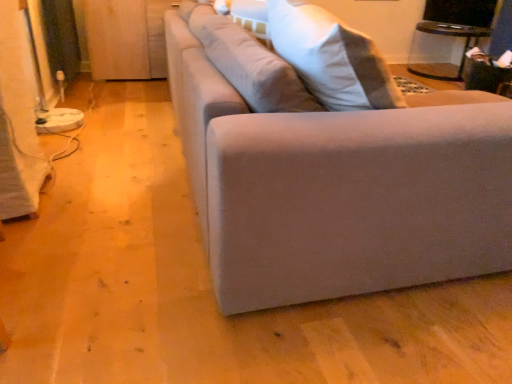
Question: Can you confirm if transparent glass table at upper right is smaller than suede-like beige couch at center?

Choices:
 (A) yes
 (B) no

Answer: (A)

Question: From the image's perspective, is transparent glass table at upper right on suede-like beige couch at center?

Choices:
 (A) yes
 (B) no

Answer: (A)

Question: Is transparent glass table at upper right oriented away from suede-like beige couch at center?

Choices:
 (A) yes
 (B) no

Answer: (B)

Question: From a real-world perspective, does transparent glass table at upper right stand above suede-like beige couch at center?

Choices:
 (A) yes
 (B) no

Answer: (B)

Question: Considering the relative positions of transparent glass table at upper right and suede-like beige couch at center in the image provided, is transparent glass table at upper right to the left of suede-like beige couch at center from the viewer's perspective?

Choices:
 (A) no
 (B) yes

Answer: (A)

Question: In terms of height, does wooden at left look taller or shorter compared to transparent glass table at upper right?

Choices:
 (A) tall
 (B) short

Answer: (A)

Question: From a real-world perspective, relative to transparent glass table at upper right, is wooden at left vertically above or below?

Choices:
 (A) above
 (B) below

Answer: (A)

Question: Considering their positions, is wooden at left located in front of or behind transparent glass table at upper right?

Choices:
 (A) front
 (B) behind

Answer: (A)

Question: In the image, is wooden at left on the left side or the right side of transparent glass table at upper right?

Choices:
 (A) left
 (B) right

Answer: (A)

Question: From a real-world perspective, is transparent glass table at upper right positioned above or below suede-like beige couch at center?

Choices:
 (A) above
 (B) below

Answer: (B)

Question: Visually, is transparent glass table at upper right positioned to the left or to the right of suede-like beige couch at center?

Choices:
 (A) right
 (B) left

Answer: (A)

Question: Which is correct: transparent glass table at upper right is inside suede-like beige couch at center, or outside of it?

Choices:
 (A) outside
 (B) inside

Answer: (A)

Question: Considering the positions of transparent glass table at upper right and suede-like beige couch at center in the image, is transparent glass table at upper right taller or shorter than suede-like beige couch at center?

Choices:
 (A) tall
 (B) short

Answer: (B)

Question: Is point (502, 160) positioned closer to the camera than point (157, 74)?

Choices:
 (A) farther
 (B) closer

Answer: (B)

Question: Relative to wooden at left, is suede-like beige couch at center in front or behind?

Choices:
 (A) front
 (B) behind

Answer: (A)